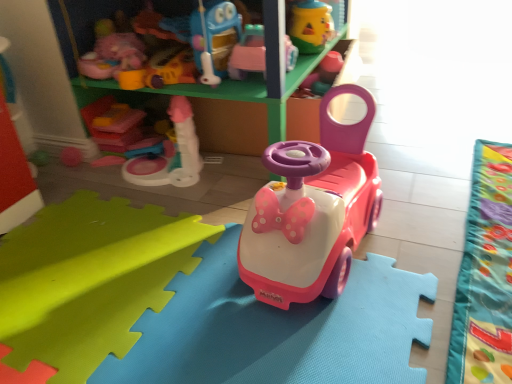
Question: From a real-world perspective, is rubber duck at upper center, the fifth toy positioned from the left, positioned above or below pink plastic toy car at center, the 3th toy viewed from the right?

Choices:
 (A) below
 (B) above

Answer: (B)

Question: Is rubber duck at upper center, the 1th toy viewed from the right, inside the boundaries of pink plastic toy car at center, the 3th toy viewed from the right, or outside?

Choices:
 (A) inside
 (B) outside

Answer: (B)

Question: Which object is positioned closest to the matte pink plastic toy at center, acting as the first toy starting from the left?

Choices:
 (A) pink plastic toy car at center, arranged as the 3th toy when viewed from the left
 (B) pink plastic toy car at center, positioned as the fourth toy in left-to-right order
 (C) green plastic shelf at upper center
 (D) matte pink plastic walker at upper center, the second toy viewed from the left
 (E) rubber duck at upper center, the fifth toy positioned from the left

Answer: (C)

Question: Which of these objects is positioned closest to the pink plastic toy car at center, which is the second toy in right-to-left order?

Choices:
 (A) pink plastic toy car at center, the 3th toy viewed from the right
 (B) green plastic shelf at upper center
 (C) matte pink plastic walker at upper center, which is the fourth toy from right to left
 (D) velvet green blanket at lower right
 (E) rubber duck at upper center, the 1th toy viewed from the right

Answer: (D)